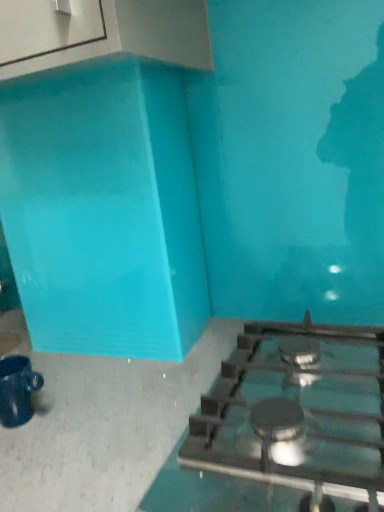
What are the coordinates of `satin silver gas stove at lower right` in the screenshot? It's located at (298, 411).

Measure the distance between satin silver gas stove at lower right and camera.

The distance of satin silver gas stove at lower right from camera is 18.60 inches.

What do you see at coordinates (298, 411) in the screenshot? I see `satin silver gas stove at lower right` at bounding box center [298, 411].

What do you see at coordinates (17, 390) in the screenshot?
I see `matte black mug at lower left` at bounding box center [17, 390].

Identify the location of matte black mug at lower left. (17, 390).

Identify the location of satin silver gas stove at lower right. (298, 411).

In the image, is matte black mug at lower left on the left side or the right side of satin silver gas stove at lower right?

matte black mug at lower left is to the left of satin silver gas stove at lower right.

Does matte black mug at lower left come in front of satin silver gas stove at lower right?

No, the depth of matte black mug at lower left is greater than that of satin silver gas stove at lower right.

Is point (17, 397) closer to viewer compared to point (264, 364)?

Yes, it is.

From the image's perspective, which object appears higher, matte black mug at lower left or satin silver gas stove at lower right?

satin silver gas stove at lower right.

From a real-world perspective, is matte black mug at lower left on top of satin silver gas stove at lower right?

Yes, from a real-world perspective, matte black mug at lower left is on top of satin silver gas stove at lower right.

Between matte black mug at lower left and satin silver gas stove at lower right, which one has smaller width?

With smaller width is matte black mug at lower left.

Considering the sizes of matte black mug at lower left and satin silver gas stove at lower right in the image, is matte black mug at lower left taller or shorter than satin silver gas stove at lower right?

In the image, matte black mug at lower left appears to be taller than satin silver gas stove at lower right.

Considering the sizes of matte black mug at lower left and satin silver gas stove at lower right in the image, is matte black mug at lower left bigger or smaller than satin silver gas stove at lower right?

matte black mug at lower left is smaller than satin silver gas stove at lower right.

Does matte black mug at lower left contain satin silver gas stove at lower right?

No.

Is matte black mug at lower left beside satin silver gas stove at lower right?

There is a gap between matte black mug at lower left and satin silver gas stove at lower right.

Could you tell me if matte black mug at lower left is turned towards satin silver gas stove at lower right?

No.

Can you tell me how much matte black mug at lower left and satin silver gas stove at lower right differ in facing direction?

The angle between the facing direction of matte black mug at lower left and the facing direction of satin silver gas stove at lower right is 3.16 degrees.

Measure the distance from matte black mug at lower left to satin silver gas stove at lower right.

matte black mug at lower left is 16.74 inches from satin silver gas stove at lower right.

Where is `gas stove lying in front of the matte black mug at lower left`? gas stove lying in front of the matte black mug at lower left is located at coordinates (298, 411).

Which is more to the right, satin silver gas stove at lower right or matte black mug at lower left?

From the viewer's perspective, satin silver gas stove at lower right appears more on the right side.

Which is behind, satin silver gas stove at lower right or matte black mug at lower left?

matte black mug at lower left is behind.

Between point (238, 384) and point (25, 360), which one is positioned in front?

The point (238, 384) is more forward.

From the image's perspective, is satin silver gas stove at lower right below matte black mug at lower left?

Incorrect, from the image's perspective, satin silver gas stove at lower right is higher than matte black mug at lower left.

From a real-world perspective, is satin silver gas stove at lower right physically located above or below matte black mug at lower left?

In terms of real-world spatial position, satin silver gas stove at lower right is below matte black mug at lower left.

Which object is thinner, satin silver gas stove at lower right or matte black mug at lower left?

With smaller width is matte black mug at lower left.

Considering the sizes of satin silver gas stove at lower right and matte black mug at lower left in the image, is satin silver gas stove at lower right taller or shorter than matte black mug at lower left?

Clearly, satin silver gas stove at lower right is shorter compared to matte black mug at lower left.

Who is bigger, satin silver gas stove at lower right or matte black mug at lower left?

satin silver gas stove at lower right.

Is satin silver gas stove at lower right surrounding matte black mug at lower left?

No, matte black mug at lower left is not a part of satin silver gas stove at lower right.

Are satin silver gas stove at lower right and matte black mug at lower left far apart?

No, satin silver gas stove at lower right is not far from matte black mug at lower left.

Does satin silver gas stove at lower right turn towards matte black mug at lower left?

No, satin silver gas stove at lower right is not facing towards matte black mug at lower left.

How different are the orientations of satin silver gas stove at lower right and matte black mug at lower left in degrees?

They differ by 3.16 degrees in their facing directions.

I want to click on gas stove in front of the matte black mug at lower left, so click(298, 411).

The width and height of the screenshot is (384, 512). I want to click on coffee cup on the left of satin silver gas stove at lower right, so pyautogui.click(x=17, y=390).

What are the coordinates of `gas stove in front of the matte black mug at lower left` in the screenshot? It's located at (298, 411).